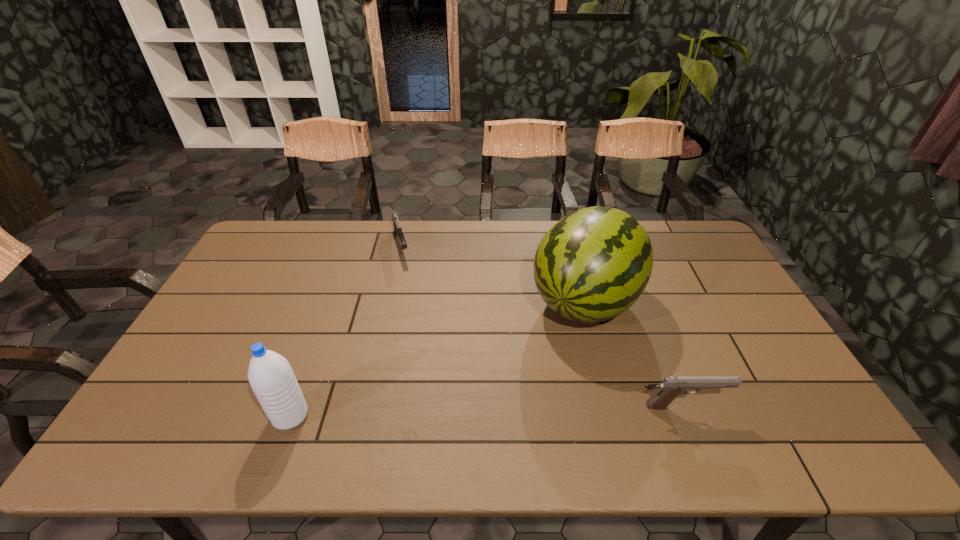
You are a GUI agent. You are given a task and a screenshot of the screen. Output one action in this format:
    pyautogui.click(x=<x>, y=<y>)
    Task: Click on the vacant space located at the muzzle end of the second object from left to right
    
    Given the screenshot: What is the action you would take?
    pyautogui.click(x=416, y=313)

Find the location of a particular element. Image resolution: width=960 pixels, height=540 pixels. vacant space located at the muzzle end of the second object from left to right is located at coordinates (426, 349).

Locate an element on the screen. Image resolution: width=960 pixels, height=540 pixels. vacant space located 0.190m at the stem end of the second farthest object is located at coordinates point(523,382).

This screenshot has width=960, height=540. Find the location of `free location located at the stem end of the second farthest object`. free location located at the stem end of the second farthest object is located at coordinates (544, 355).

The image size is (960, 540). I want to click on free space located at the stem end of the second farthest object, so click(x=517, y=390).

Identify the location of object situated at the far edge. (397, 228).

Where is `water bottle present at the near edge`? This screenshot has width=960, height=540. water bottle present at the near edge is located at coordinates (270, 375).

Locate an element on the screen. This screenshot has height=540, width=960. pistol that is at the near edge is located at coordinates (672, 386).

What are the coordinates of `vacant space at the far edge of the desktop` in the screenshot? It's located at (478, 247).

Image resolution: width=960 pixels, height=540 pixels. Find the location of `free spot at the near edge of the desktop`. free spot at the near edge of the desktop is located at coordinates 314,392.